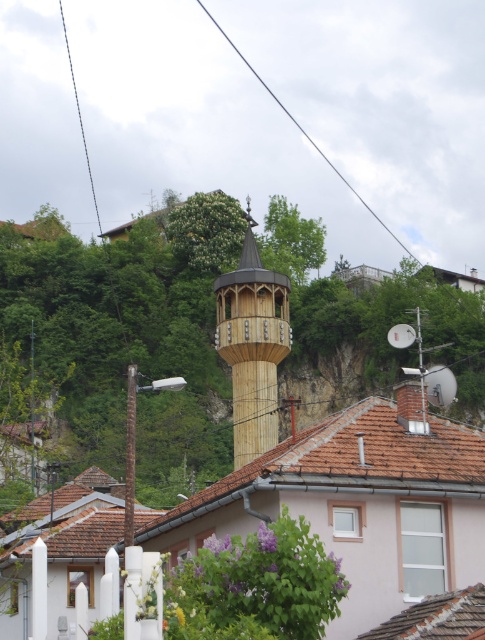
Between black wire at upper center and black wire at upper left, which one is positioned higher?

black wire at upper left is higher up.

Can you confirm if black wire at upper center is positioned below black wire at upper left?

Correct, black wire at upper center is located below black wire at upper left.

Between point (399, 237) and point (89, 160), which one is positioned in front?

Point (399, 237) is in front.

Identify the location of black wire at upper center. (302, 129).

Describe the element at coordinates (253, 344) in the screenshot. The height and width of the screenshot is (640, 485). I see `wooden minaret at center` at that location.

Describe the element at coordinates (253, 344) in the screenshot. The width and height of the screenshot is (485, 640). I see `wooden minaret at center` at that location.

The width and height of the screenshot is (485, 640). I want to click on wooden minaret at center, so click(x=253, y=344).

Find the location of a particular element. Image resolution: width=485 pixels, height=640 pixels. wooden minaret at center is located at coordinates (253, 344).

Does wooden minaret at center have a smaller size compared to black wire at upper center?

Yes, wooden minaret at center is smaller than black wire at upper center.

Which is behind, point (246, 292) or point (274, 100)?

Point (274, 100)

What are the coordinates of `wooden minaret at center` in the screenshot? It's located at (253, 344).